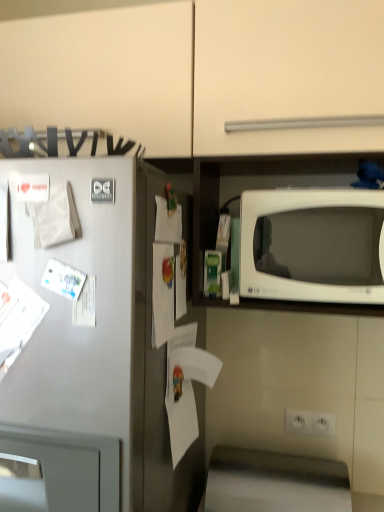
Question: Is white glossy microwave at right facing towards white matte paper at left, the second paper viewed from the left?

Choices:
 (A) no
 (B) yes

Answer: (A)

Question: Would you say white glossy microwave at right is a long distance from white matte paper at left, the third paper ordered from the bottom?

Choices:
 (A) yes
 (B) no

Answer: (B)

Question: From a real-world perspective, does white glossy microwave at right sit lower than white matte paper at left, the second paper viewed from the left?

Choices:
 (A) no
 (B) yes

Answer: (B)

Question: Does white glossy microwave at right contain white matte paper at left, which is the 3th paper from right to left?

Choices:
 (A) no
 (B) yes

Answer: (A)

Question: Does white glossy microwave at right appear on the right side of white matte paper at left, the second paper viewed from the left?

Choices:
 (A) yes
 (B) no

Answer: (A)

Question: Is white glossy microwave at right in front of or behind white matte paper at left, which ranks as the 2th paper in top-to-bottom order, in the image?

Choices:
 (A) front
 (B) behind

Answer: (B)

Question: From the image's perspective, relative to white matte paper at left, which ranks as the 2th paper in top-to-bottom order, is white glossy microwave at right above or below?

Choices:
 (A) below
 (B) above

Answer: (A)

Question: In terms of size, does white glossy microwave at right appear bigger or smaller than white matte paper at left, which is the 3th paper from right to left?

Choices:
 (A) small
 (B) big

Answer: (B)

Question: Is white glossy microwave at right taller or shorter than white matte paper at left, which ranks as the 2th paper in top-to-bottom order?

Choices:
 (A) tall
 (B) short

Answer: (A)

Question: Do you think white paper at center, the first paper when ordered from bottom to top, is within white matte paper at left, which ranks as the 2th paper in top-to-bottom order, or outside of it?

Choices:
 (A) inside
 (B) outside

Answer: (B)

Question: Is white paper at center, the first paper when ordered from bottom to top, in front of or behind white matte paper at left, which is the 3th paper from right to left, in the image?

Choices:
 (A) behind
 (B) front

Answer: (A)

Question: Is white paper at center, arranged as the first paper when viewed from the right, taller or shorter than white matte paper at left, the third paper ordered from the bottom?

Choices:
 (A) tall
 (B) short

Answer: (A)

Question: Based on their sizes in the image, would you say white paper at center, the 4th paper when ordered from top to bottom, is bigger or smaller than white matte paper at left, which is the 3th paper from right to left?

Choices:
 (A) big
 (B) small

Answer: (A)

Question: Is white plastic electric outlet at lower center wider or thinner than white matte paper at left, which ranks as the 2th paper in top-to-bottom order?

Choices:
 (A) thin
 (B) wide

Answer: (A)

Question: Based on their sizes in the image, would you say white plastic electric outlet at lower center is bigger or smaller than white matte paper at left, the second paper viewed from the left?

Choices:
 (A) big
 (B) small

Answer: (B)